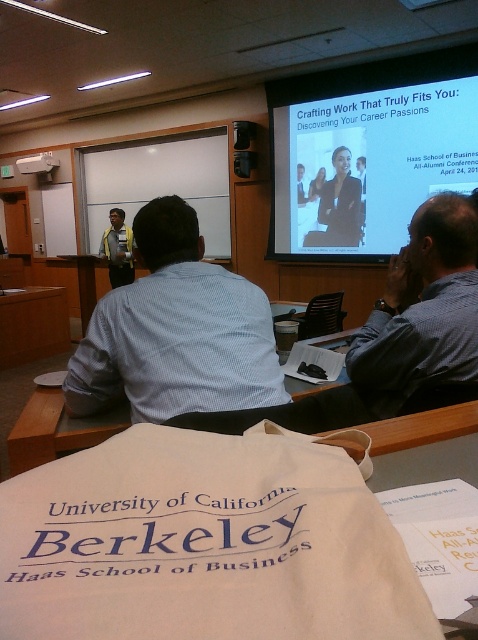
Locate an element on the screen. The height and width of the screenshot is (640, 478). blue shirt at upper center is located at coordinates click(423, 316).

Does blue shirt at upper center appear on the left side of whiteboard at upper center?

Incorrect, blue shirt at upper center is not on the left side of whiteboard at upper center.

Find the location of a particular element. Image resolution: width=478 pixels, height=640 pixels. blue shirt at upper center is located at coordinates (423, 316).

Is black suit at center in front of yellow shirt at center?

Yes, black suit at center is in front of yellow shirt at center.

Is point (336, 237) farther from viewer compared to point (111, 264)?

No, (336, 237) is closer to viewer.

The height and width of the screenshot is (640, 478). I want to click on black suit at center, so click(338, 205).

Where is `black suit at center`? black suit at center is located at coordinates (338, 205).

Does blue shirt at upper center have a larger size compared to white plastic projector at upper center?

No.

I want to click on blue shirt at upper center, so click(423, 316).

Image resolution: width=478 pixels, height=640 pixels. What are the coordinates of `blue shirt at upper center` in the screenshot? It's located at (423, 316).

Where is `blue shirt at upper center`? blue shirt at upper center is located at coordinates (423, 316).